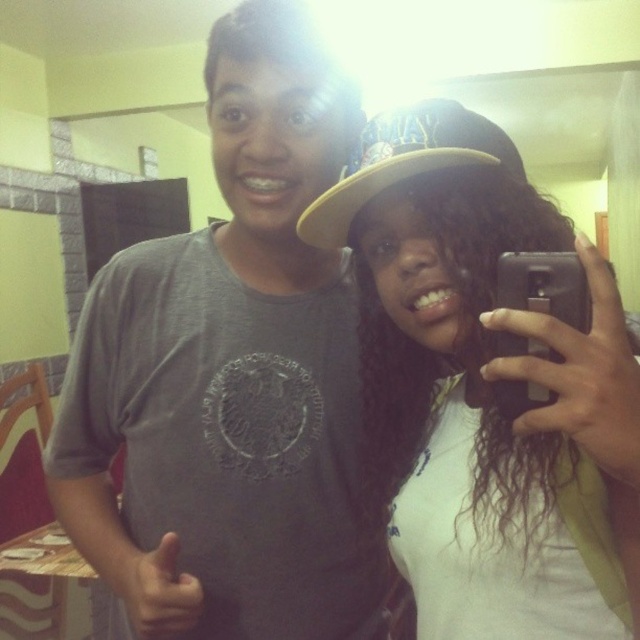
In the scene shown: Can you confirm if white matte hat at upper center is positioned to the right of tan fabric baseball cap at upper right?

Yes, white matte hat at upper center is to the right of tan fabric baseball cap at upper right.

Is white matte hat at upper center thinner than tan fabric baseball cap at upper right?

No.

Image resolution: width=640 pixels, height=640 pixels. What are the coordinates of `white matte hat at upper center` in the screenshot? It's located at (484, 388).